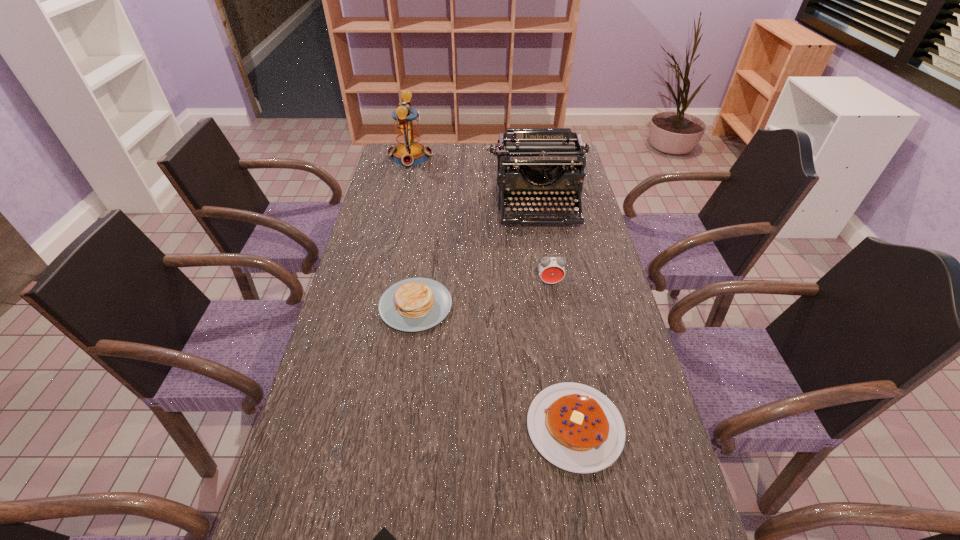
Select which object is the third closest to the right pancake. Please provide its 2D coordinates. Your answer should be formatted as a tuple, i.e. [(x, y)], where the tuple contains the x and y coordinates of a point satisfying the conditions above.

[(551, 269)]

Image resolution: width=960 pixels, height=540 pixels. I want to click on object that is the closest to the fourth shortest object, so click(529, 151).

In order to click on free region that satisfies the following two spatial constraints: 1. on the front-facing side of the farthest object; 2. on the back side of the right pancake in this screenshot , I will do `click(348, 427)`.

Identify the location of free space that satisfies the following two spatial constraints: 1. on the back side of the left pancake; 2. on the front-facing side of the farthest object. The width and height of the screenshot is (960, 540). (437, 157).